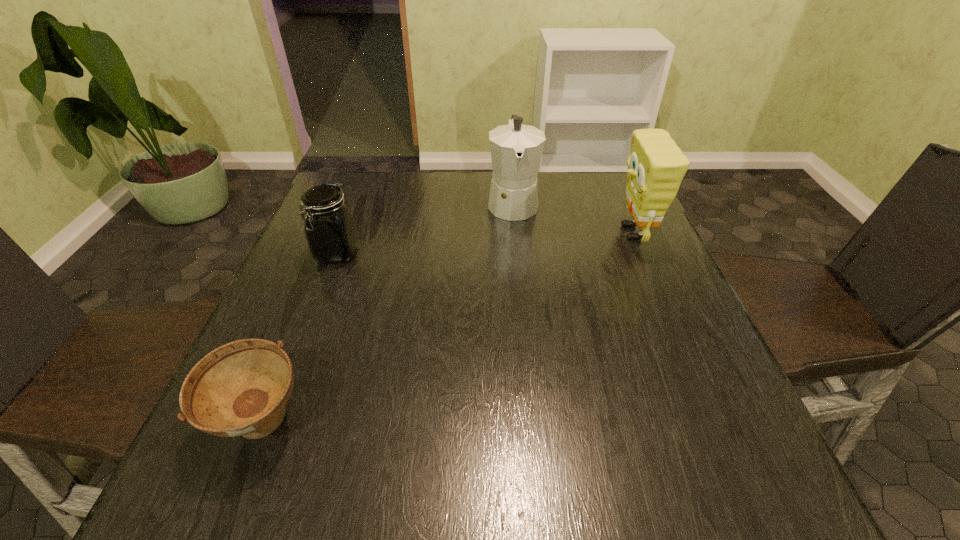
Where is `vacant space that's between the soup bowl and the sponge`? Image resolution: width=960 pixels, height=540 pixels. vacant space that's between the soup bowl and the sponge is located at coordinates (447, 328).

What are the coordinates of `free space between the sponge and the jar` in the screenshot? It's located at (485, 243).

The height and width of the screenshot is (540, 960). I want to click on vacant area that lies between the third tallest object and the coffeepot, so click(425, 228).

The height and width of the screenshot is (540, 960). Identify the location of free area in between the second shortest object and the rightmost object. (485, 243).

Find the location of a particular element. vacant area that lies between the soup bowl and the third tallest object is located at coordinates (300, 339).

Choose which object is the nearest neighbor to the third object from left to right. Please provide its 2D coordinates. Your answer should be formatted as a tuple, i.e. [(x, y)], where the tuple contains the x and y coordinates of a point satisfying the conditions above.

[(656, 165)]

Where is `object that stands as the closest to the sponge`? object that stands as the closest to the sponge is located at coordinates (516, 150).

Locate an element on the screen. Image resolution: width=960 pixels, height=540 pixels. free spot that satisfies the following two spatial constraints: 1. on the face of the sponge; 2. on the lid of the third tallest object is located at coordinates [x=641, y=253].

At what (x,y) coordinates should I click in order to perform the action: click on vacant space that satisfies the following two spatial constraints: 1. on the face of the rightmost object; 2. on the lid of the jar. Please return your answer as a coordinate pair (x, y). The image size is (960, 540). Looking at the image, I should click on (641, 253).